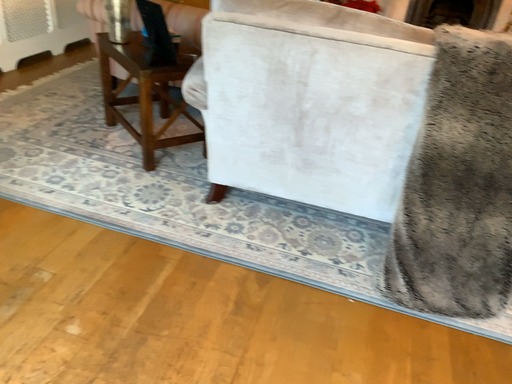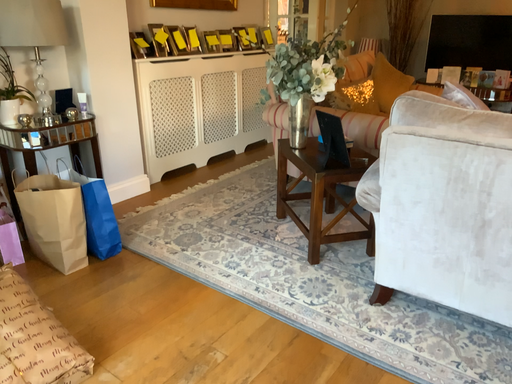
Question: Which way did the camera rotate in the video?

Choices:
 (A) rotated upward
 (B) rotated downward

Answer: (A)